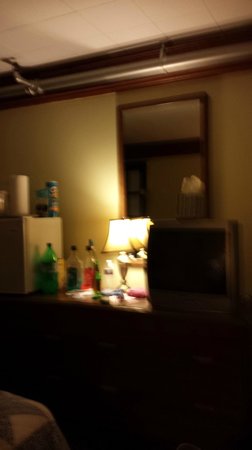
This screenshot has height=450, width=252. In order to click on television in this screenshot , I will do `click(206, 264)`.